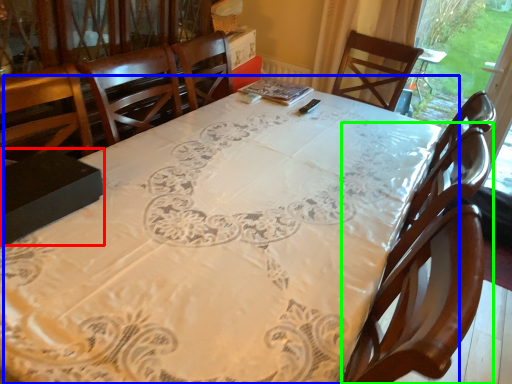
Question: Which object is the farthest from box (highlighted by a red box)? Choose among these: table (highlighted by a blue box) or chair (highlighted by a green box).

Choices:
 (A) table
 (B) chair

Answer: (B)